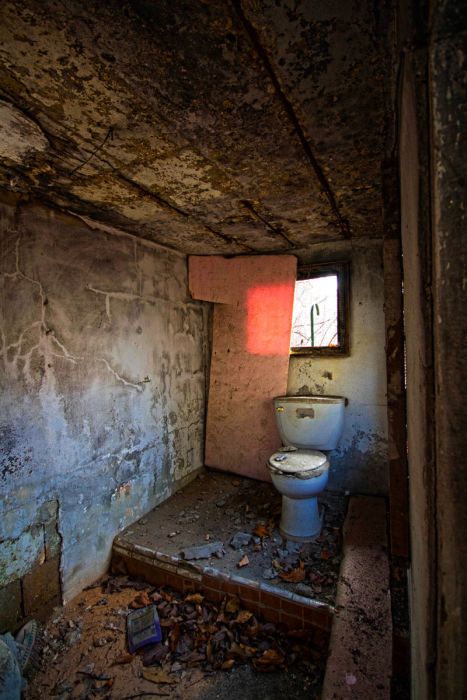
Where is `toilet handle`? This screenshot has width=467, height=700. toilet handle is located at coordinates (279, 407).